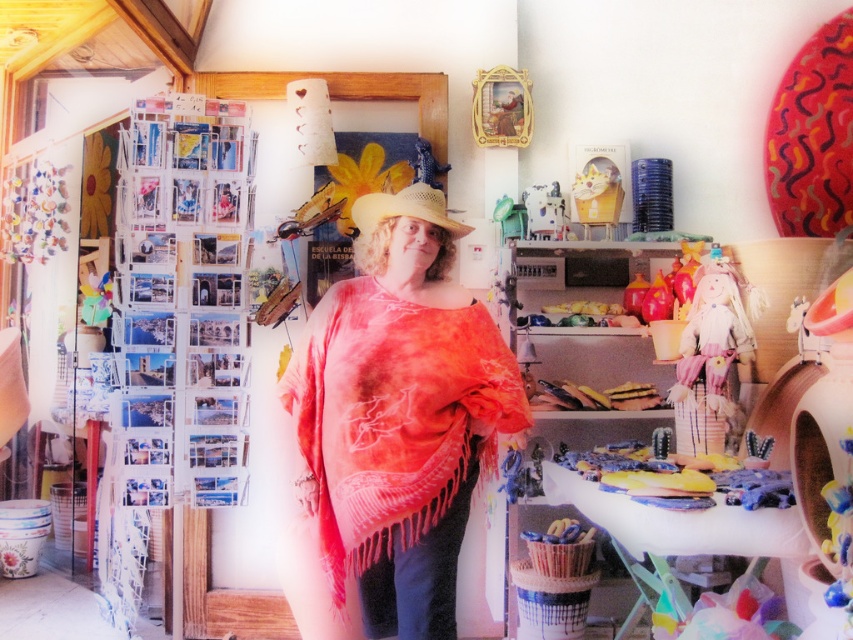
Question: Is tie-dye fabric poncho at center wider than woven straw cowboy hat at center?

Choices:
 (A) yes
 (B) no

Answer: (A)

Question: Among these points, which one is farthest from the camera?

Choices:
 (A) (393, 376)
 (B) (364, 198)

Answer: (B)

Question: Which of the following is the farthest from the observer?

Choices:
 (A) (431, 204)
 (B) (293, 472)

Answer: (B)

Question: Does tie-dye fabric poncho at center appear under woven straw cowboy hat at center?

Choices:
 (A) no
 (B) yes

Answer: (B)

Question: Which point is farther to the camera?

Choices:
 (A) (451, 614)
 (B) (363, 195)

Answer: (B)

Question: In this image, where is tie-dye fabric poncho at center located relative to woven straw cowboy hat at center?

Choices:
 (A) right
 (B) left

Answer: (B)